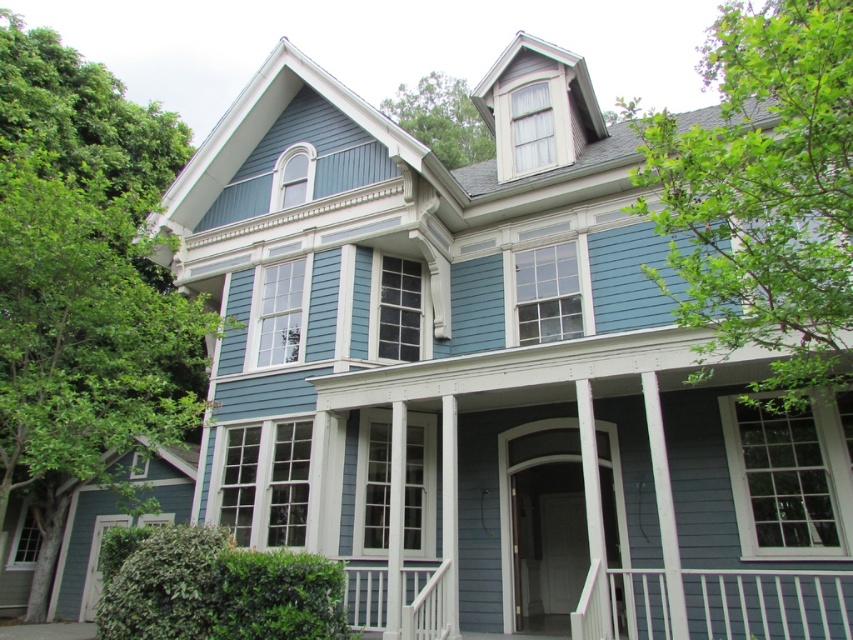
Does green leafy tree at left appear over white painted wood porch at lower center?

Indeed, green leafy tree at left is positioned over white painted wood porch at lower center.

Does point (26, 326) come in front of point (405, 579)?

Yes, point (26, 326) is closer to viewer.

Find the location of a particular element. green leafy tree at left is located at coordinates (84, 285).

Does green leafy tree at upper right appear on the left side of white painted wood porch at lower center?

No, green leafy tree at upper right is not to the left of white painted wood porch at lower center.

Is point (849, 81) more distant than point (737, 604)?

No, it is in front of (737, 604).

Locate an element on the screen. This screenshot has width=853, height=640. green leafy tree at upper right is located at coordinates (762, 196).

Who is higher up, green leafy tree at left or green leafy tree at upper center?

green leafy tree at upper center

Locate an element on the screen. This screenshot has height=640, width=853. green leafy tree at left is located at coordinates (84, 285).

The width and height of the screenshot is (853, 640). In order to click on green leafy tree at left in this screenshot , I will do `click(84, 285)`.